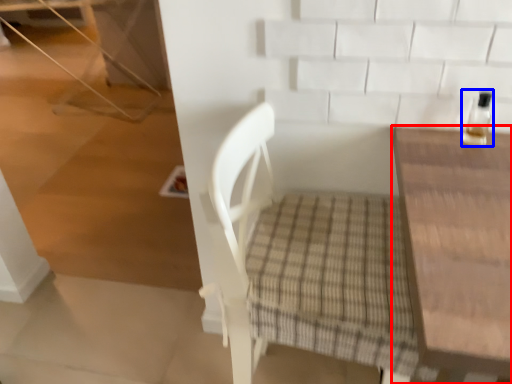
Question: Among these objects, which one is farthest to the camera, table (highlighted by a red box) or bottle (highlighted by a blue box)?

Choices:
 (A) table
 (B) bottle

Answer: (B)